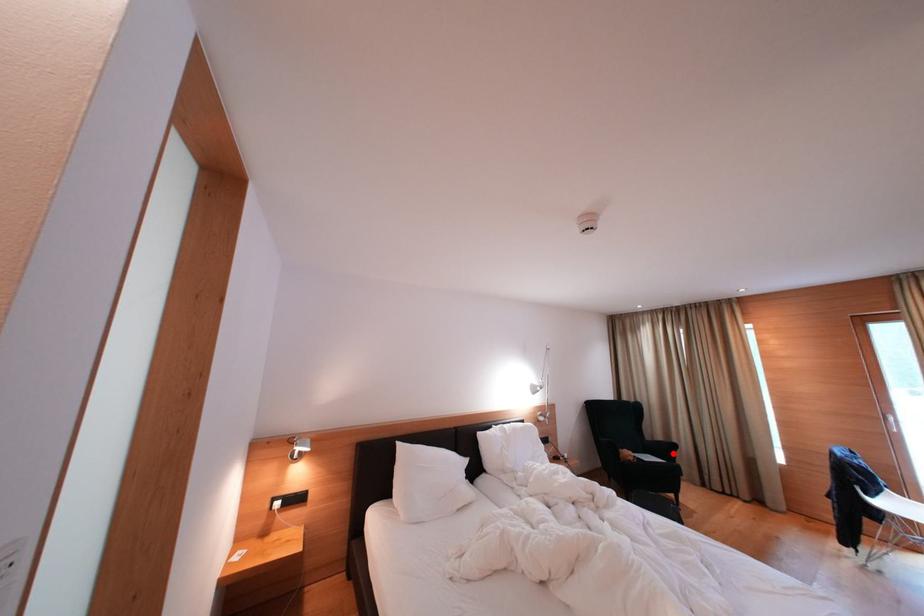
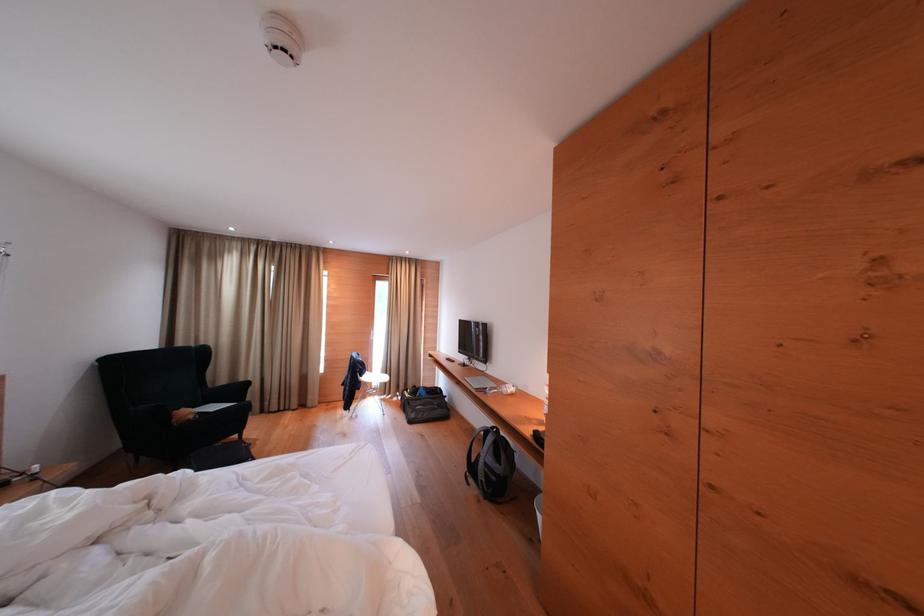
Where in the second image is the point corresponding to the highlighted location from the first image?

(244, 394)